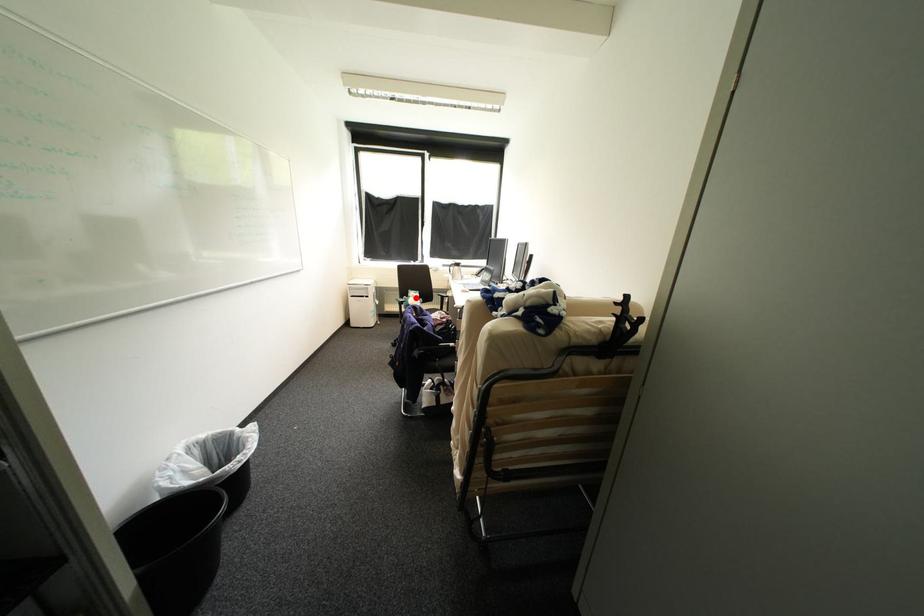
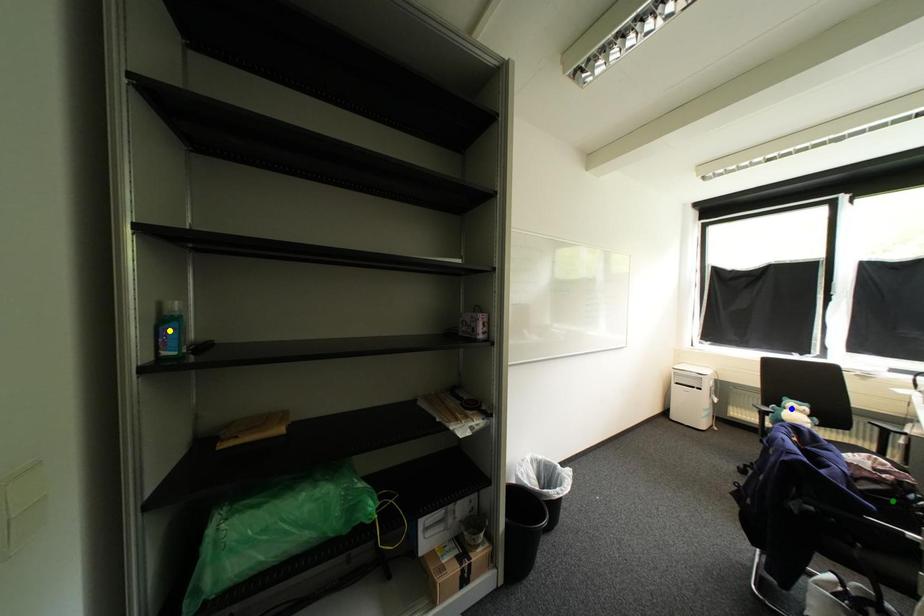
Question: I am providing you with two images of the same scene from different viewpoints. A red point is marked on the first image. You are given multiple points on the second image. Which point in image 2 is actually the same real-world point as the red point in image 1?

Choices:
 (A) yellow point
 (B) blue point
 (C) green point

Answer: (B)